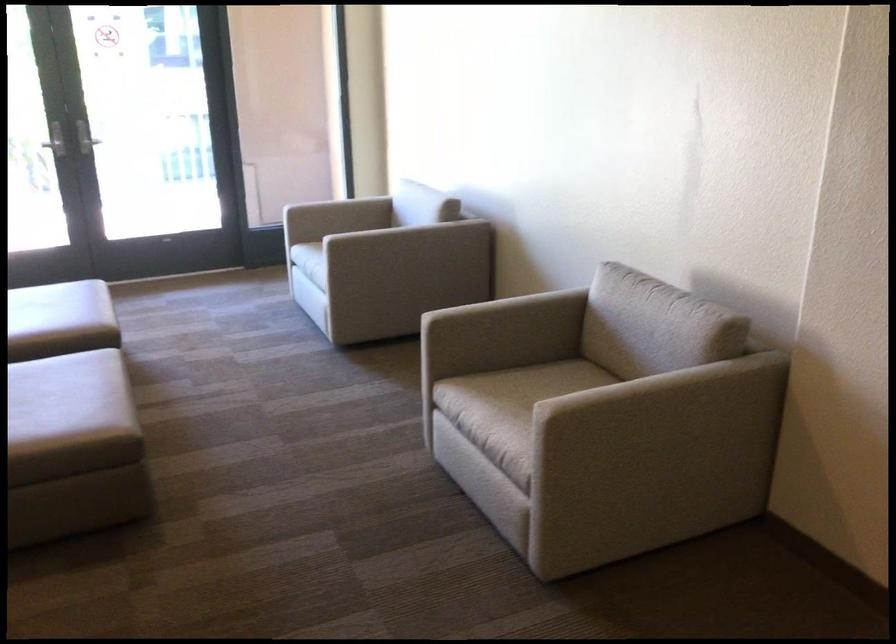
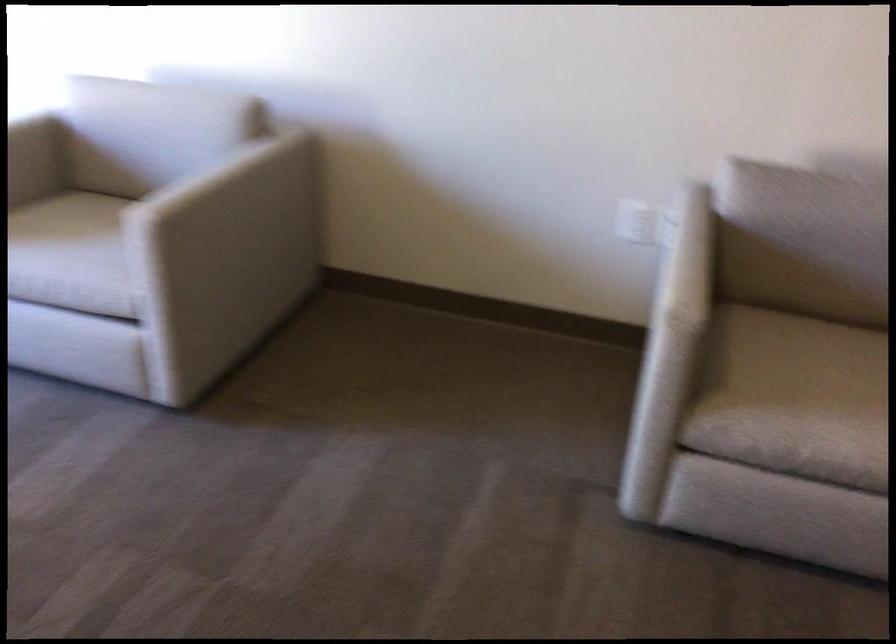
The point at (417, 242) is marked in the first image. Where is the corresponding point in the second image?

(295, 187)